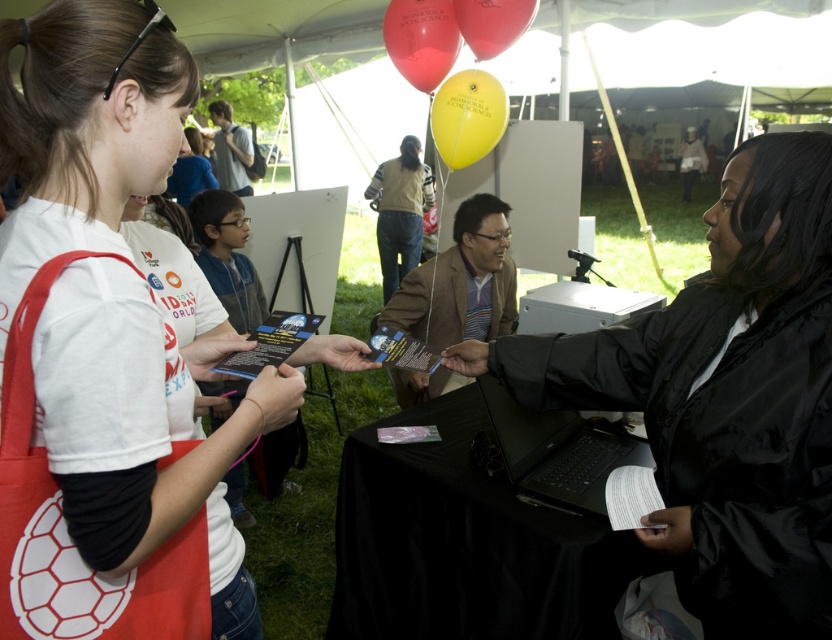
Does black matte jacket at center lie in front of black matte laptop at lower center?

Yes, black matte jacket at center is in front of black matte laptop at lower center.

Is black matte jacket at center wider than black matte laptop at lower center?

Yes, black matte jacket at center is wider than black matte laptop at lower center.

Between point (816, 564) and point (646, 442), which one is positioned behind?

Positioned behind is point (646, 442).

The image size is (832, 640). Find the location of `black matte jacket at center`. black matte jacket at center is located at coordinates (717, 406).

Is point (116, 227) positioned in front of point (578, 483)?

Yes, it is.

Who is more forward, (83, 323) or (572, 445)?

Positioned in front is point (83, 323).

Find the location of a particular element. The width and height of the screenshot is (832, 640). white matte t-shirt at upper left is located at coordinates (83, 128).

You are a GUI agent. You are given a task and a screenshot of the screen. Output one action in this format:
    pyautogui.click(x=<x>, y=<y>)
    Task: Click on the white matte t-shirt at upper left
    
    Given the screenshot: What is the action you would take?
    pyautogui.click(x=83, y=128)

Between matte brown blazer at center and black matte laptop at lower center, which one appears on the left side from the viewer's perspective?

Positioned to the left is matte brown blazer at center.

Who is lower down, matte brown blazer at center or black matte laptop at lower center?

black matte laptop at lower center is below.

Is point (405, 289) positioned in front of point (558, 438)?

No.

Locate an element on the screen. matte brown blazer at center is located at coordinates (461, 282).